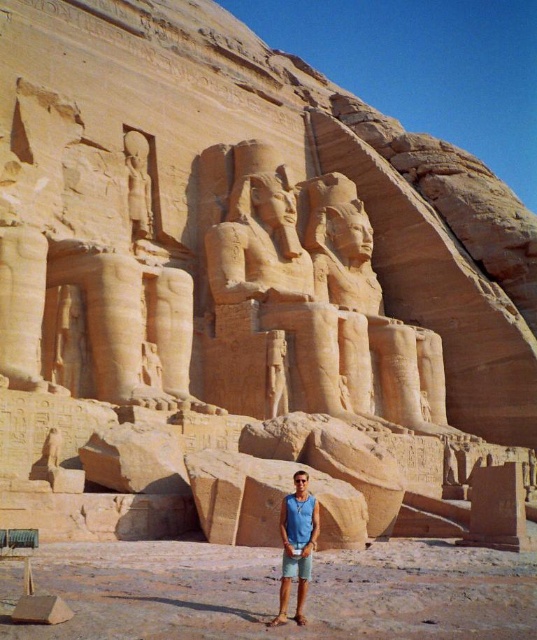
You are standing at the Great Temple of Ramses II at Abu Simbel and want to take a photo of both the point at location (280, 614) and the point at location (135, 173). Based on their positions, which point will appear larger in your photo?

Point at location (280, 614) will appear larger in the photo because it is closer to the camera than point at location (135, 173).

Based on the photo, you are a tour guide at the Great Temple of Ramses II. You notice a visitor pointing at the blue fabric shirt at center and the smooth sandstone statue at upper left. They ask, which object takes up more space in the image? Please explain.

The smooth sandstone statue at upper left takes up more space in the image than the blue fabric shirt at center, as the description states that the blue fabric shirt at center occupies less space than the smooth sandstone statue at upper left.

You are standing at the entrance of the Great Temple of Ramses II at Abu Simbel and want to take a photo of the massive seated statues of Ramses II. You are currently at the point marked as point [297,518]. If you move forward by 50 feet, will you be closer to the statues?

The distance of point [297,518] from camera is 108.81 feet. Moving forward by 50 feet would bring you to 58.81 feet away from the statues, so yes, you will be closer to the statues.